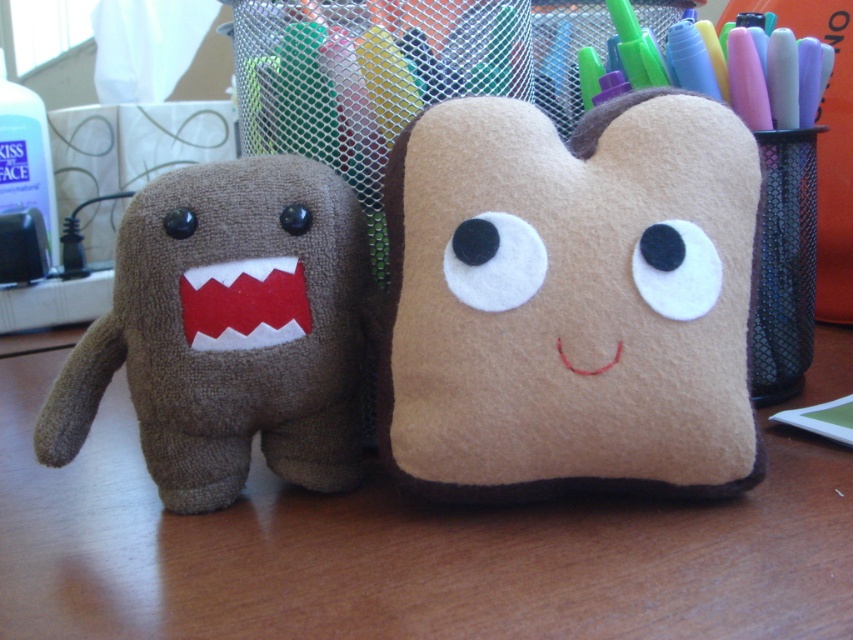
Question: Does felt plushie at center have a smaller size compared to clear plastic bottle at left?

Choices:
 (A) yes
 (B) no

Answer: (A)

Question: Which point is farther from the camera taking this photo?

Choices:
 (A) (9, 147)
 (B) (302, 296)
 (C) (646, 272)

Answer: (A)

Question: Can you confirm if brown plush toy at left is positioned to the right of clear plastic bottle at left?

Choices:
 (A) yes
 (B) no

Answer: (A)

Question: Among these points, which one is nearest to the camera?

Choices:
 (A) (103, 321)
 (B) (430, 483)
 (C) (33, 129)

Answer: (B)

Question: Which object is farther from the camera taking this photo?

Choices:
 (A) brown plush toy at left
 (B) felt plushie at center

Answer: (A)

Question: Where is felt plushie at center located in relation to clear plastic bottle at left in the image?

Choices:
 (A) right
 (B) left

Answer: (A)